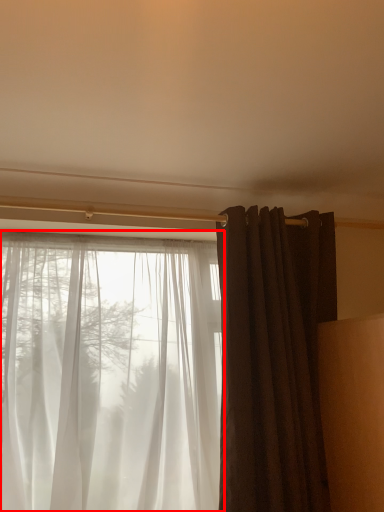
Question: Where is curtain (annotated by the red box) located in relation to curtain in the image?

Choices:
 (A) left
 (B) right

Answer: (A)